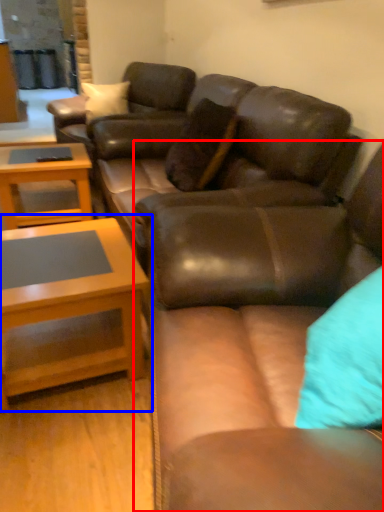
Question: Which object is further to the camera taking this photo, studio couch (highlighted by a red box) or coffee table (highlighted by a blue box)?

Choices:
 (A) studio couch
 (B) coffee table

Answer: (B)